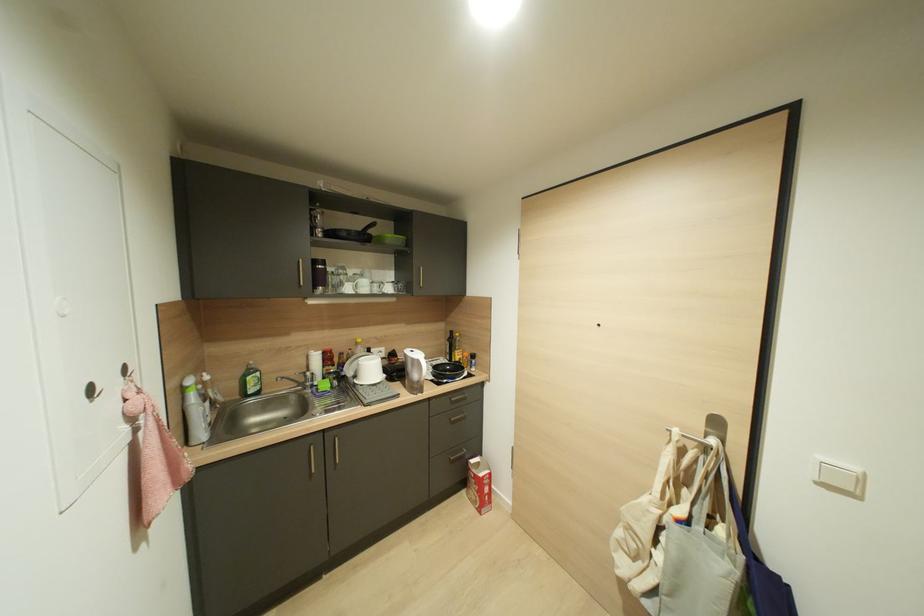
Image resolution: width=924 pixels, height=616 pixels. Find the location of `glass cup`. glass cup is located at coordinates (360, 278).